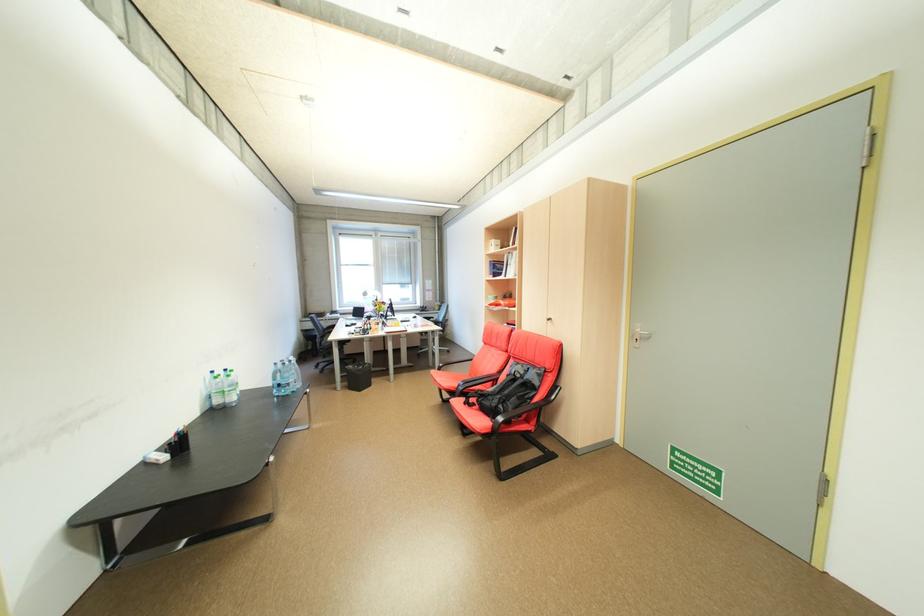
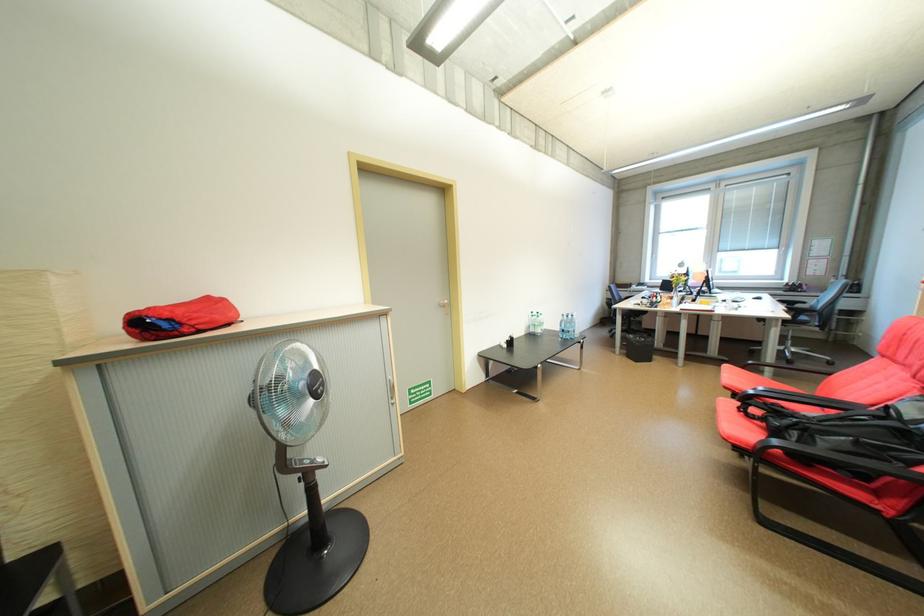
The point at (446, 379) is marked in the first image. Where is the corresponding point in the second image?

(734, 376)